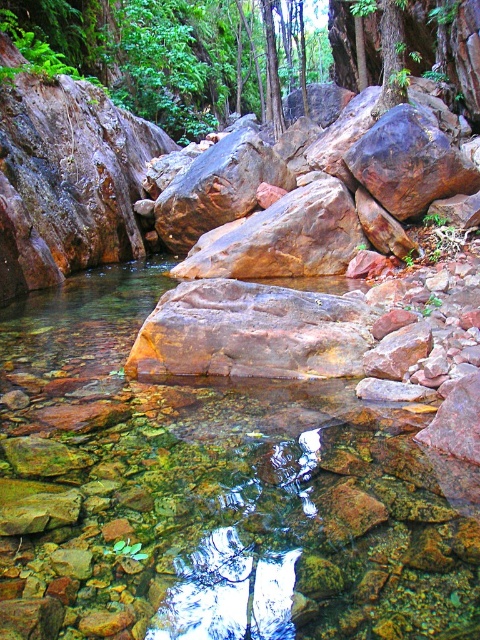
You are standing at the edge of the stream and see the point labeled as point (x=213, y=493). Based on the scene description, what is the most likely object located at that point?

The point (x=213, y=493) indicates the clear glass stream at center.

You are a hiker trying to cross the stream. You see the clear glass stream at center and the rustic brown rock at center. Which one is larger in size?

A: The rustic brown rock at center is larger than the clear glass stream at center.